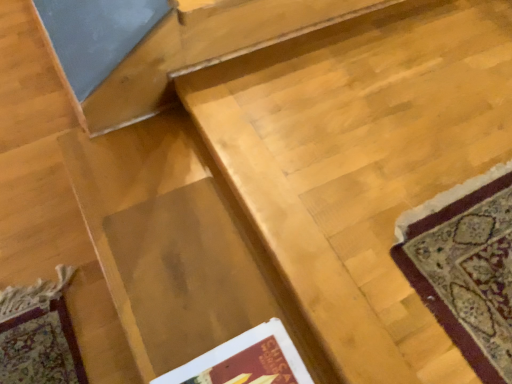
In order to face matte brown book at lower center, should I rotate leftwards or rightwards?

It's best to rotate left around 1.866 degrees.

What do you see at coordinates (246, 361) in the screenshot? This screenshot has width=512, height=384. I see `matte brown book at lower center` at bounding box center [246, 361].

Image resolution: width=512 pixels, height=384 pixels. In order to click on matte brown book at lower center in this screenshot , I will do `click(246, 361)`.

Identify the location of matte brown book at lower center. Image resolution: width=512 pixels, height=384 pixels. (246, 361).